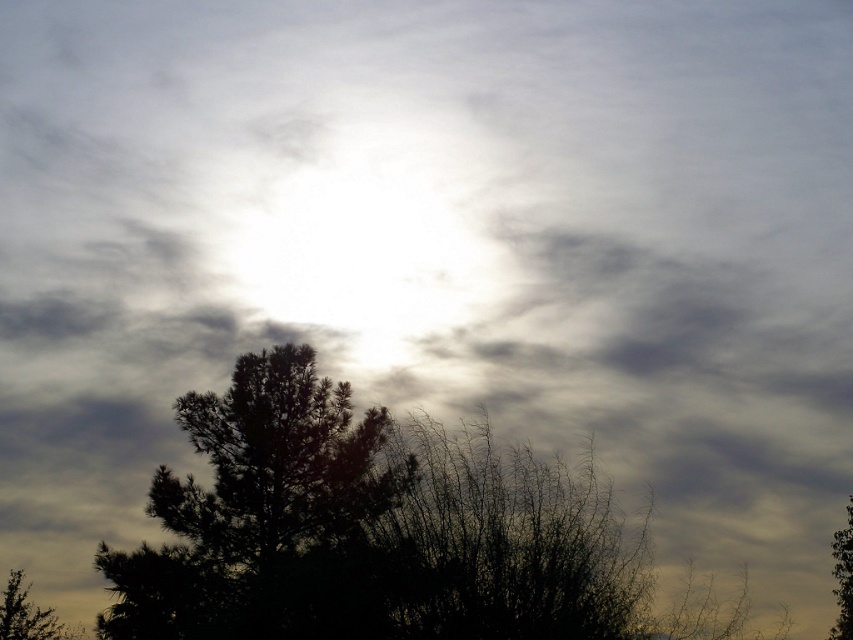
Question: Where is dark green textured tree at lower left located in relation to green leafy tree at lower right in the image?

Choices:
 (A) right
 (B) left

Answer: (B)

Question: Which point is farther from the camera taking this photo?

Choices:
 (A) click(840, 545)
 (B) click(80, 630)

Answer: (B)

Question: Is dark green textured tree at lower left positioned behind green leafy tree at lower right?

Choices:
 (A) yes
 (B) no

Answer: (B)

Question: Is dark green textured tree at lower left thinner than dark green leafy tree at lower left?

Choices:
 (A) yes
 (B) no

Answer: (B)

Question: Considering the real-world distances, which object is closest to the dark green textured tree at lower left?

Choices:
 (A) dark green leafy tree at lower left
 (B) green leafy tree at lower right

Answer: (A)

Question: Which point is farther to the camera?

Choices:
 (A) dark green leafy tree at lower left
 (B) green leafy tree at lower right

Answer: (A)